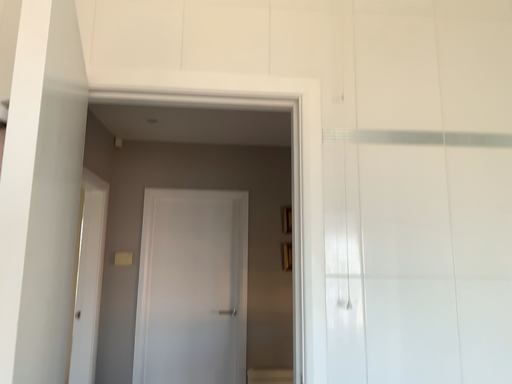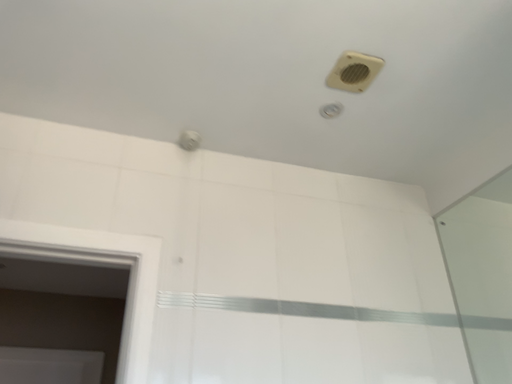
Question: How did the camera likely rotate when shooting the video?

Choices:
 (A) rotated left
 (B) rotated right

Answer: (B)